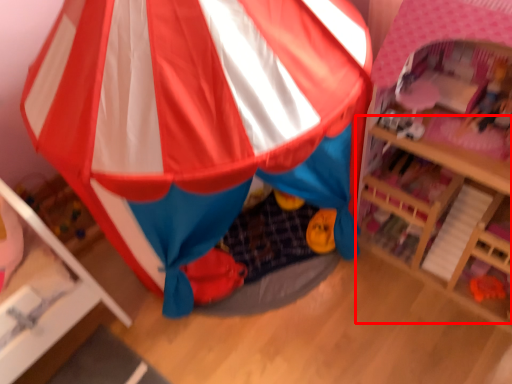
Question: In this image, where is table (annotated by the red box) located relative to tent?

Choices:
 (A) left
 (B) right

Answer: (B)